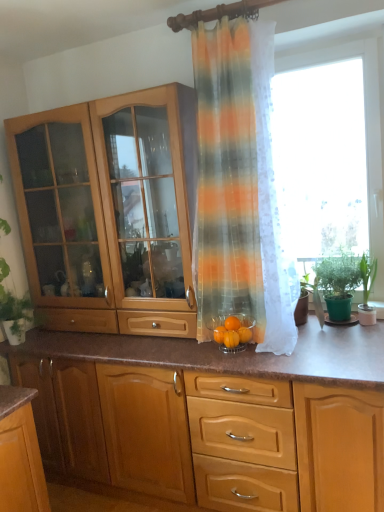
Question: From the image's perspective, is green matte plant at right, which is the 2th houseplant from right to left, under orange matte glass bowl at center, the first orange positioned from the left?

Choices:
 (A) no
 (B) yes

Answer: (A)

Question: Is green matte plant at right, which is counted as the first houseplant, starting from the left, positioned behind orange matte glass bowl at center, the second orange from the right?

Choices:
 (A) no
 (B) yes

Answer: (B)

Question: Is green matte plant at right, which is the 2th houseplant from right to left, bigger than orange matte glass bowl at center, the first orange positioned from the left?

Choices:
 (A) yes
 (B) no

Answer: (A)

Question: Is green matte plant at right, which is the 2th houseplant from right to left, aimed at orange matte glass bowl at center, the first orange positioned from the left?

Choices:
 (A) no
 (B) yes

Answer: (A)

Question: Considering the relative sizes of green matte plant at right, which is the 2th houseplant from right to left, and orange matte glass bowl at center, the first orange positioned from the left, in the image provided, is green matte plant at right, which is the 2th houseplant from right to left, smaller than orange matte glass bowl at center, the first orange positioned from the left,?

Choices:
 (A) yes
 (B) no

Answer: (B)

Question: From a real-world perspective, is green matte plant at right, which is the 2th houseplant from right to left, on top of orange matte glass bowl at center, the second orange from the right?

Choices:
 (A) yes
 (B) no

Answer: (A)

Question: Is transparent fabric at right facing away from green leafy plant at right, which is the 2th houseplant in left-to-right order?

Choices:
 (A) no
 (B) yes

Answer: (B)

Question: From a real-world perspective, is transparent fabric at right beneath green leafy plant at right, which is the 2th houseplant in left-to-right order?

Choices:
 (A) yes
 (B) no

Answer: (B)

Question: Is transparent fabric at right bigger than green leafy plant at right, the 1th houseplant in the right-to-left sequence?

Choices:
 (A) no
 (B) yes

Answer: (B)

Question: Is transparent fabric at right beside green leafy plant at right, which is the 2th houseplant in left-to-right order?

Choices:
 (A) yes
 (B) no

Answer: (B)

Question: Is transparent fabric at right not within green leafy plant at right, the 1th houseplant in the right-to-left sequence?

Choices:
 (A) yes
 (B) no

Answer: (A)

Question: Is there a large distance between transparent fabric at right and green leafy plant at right, the 1th houseplant in the right-to-left sequence?

Choices:
 (A) no
 (B) yes

Answer: (A)

Question: Considering the relative sizes of transparent fabric at right and translucent striped curtain at center in the image provided, is transparent fabric at right smaller than translucent striped curtain at center?

Choices:
 (A) no
 (B) yes

Answer: (B)